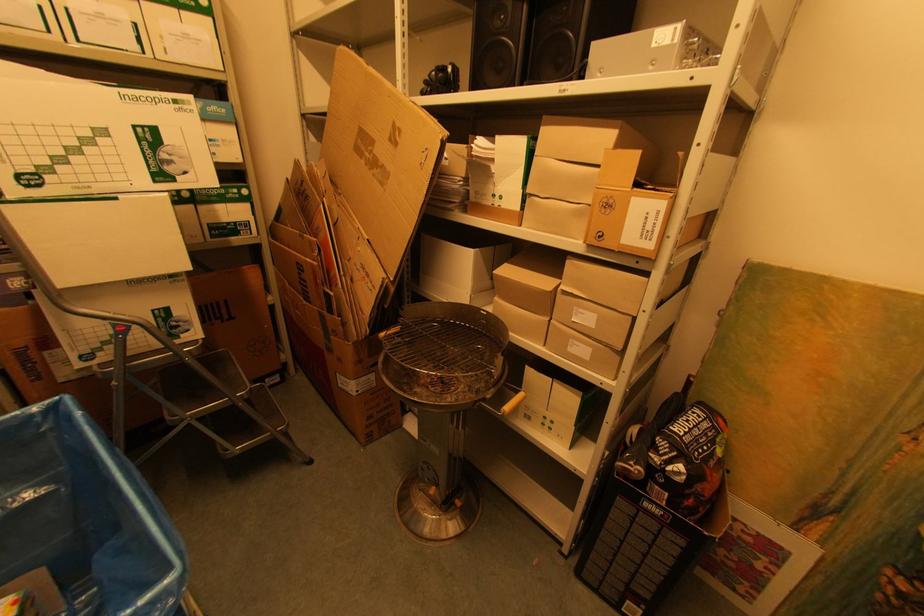
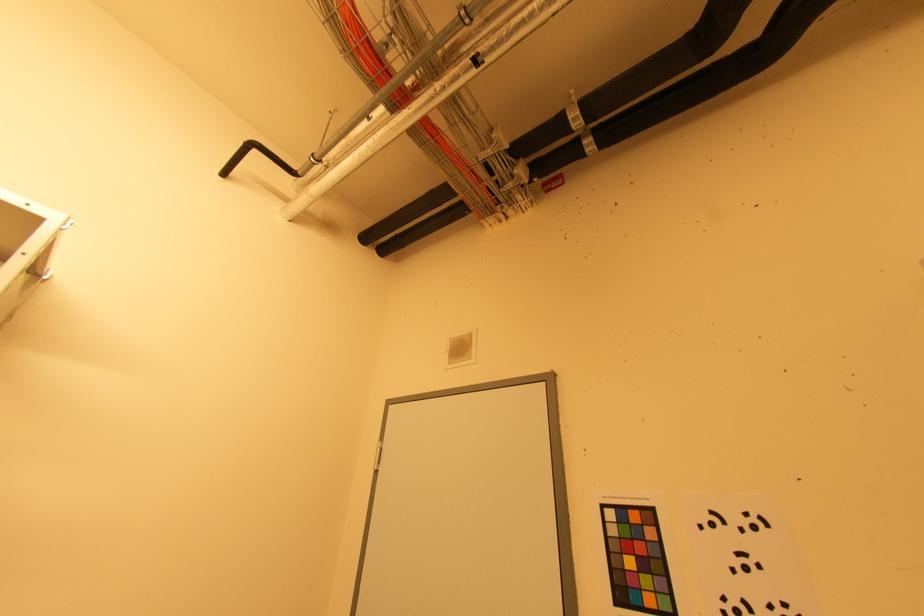
First-person continuous shooting, in which direction is the camera rotating?

The camera rotated toward right-up.